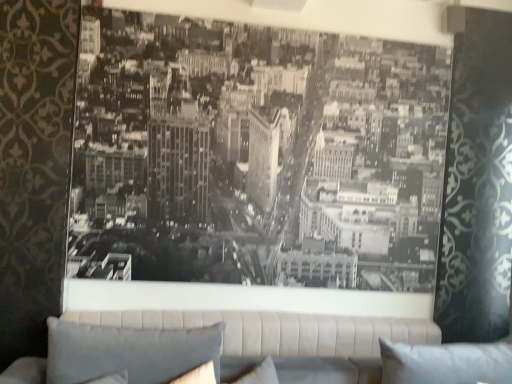
Question: From the image's perspective, is gray fabric pillow at lower left, the 2th pillow when ordered from right to left, located above or below beige fabric studio couch at center?

Choices:
 (A) above
 (B) below

Answer: (A)

Question: Is gray fabric pillow at lower left, the 2th pillow when ordered from right to left, inside the boundaries of beige fabric studio couch at center, or outside?

Choices:
 (A) outside
 (B) inside

Answer: (A)

Question: Considering the real-world distances, which object is farthest from the beige fabric studio couch at center?

Choices:
 (A) white fabric pillow at lower right, which appears as the 1th pillow when viewed from the right
 (B) gray fabric pillow at lower left, which is the first pillow from left to right

Answer: (B)

Question: Which is nearer to the gray fabric pillow at lower left, which is the first pillow from left to right?

Choices:
 (A) white fabric pillow at lower right, which is the second pillow from left to right
 (B) beige fabric studio couch at center

Answer: (B)